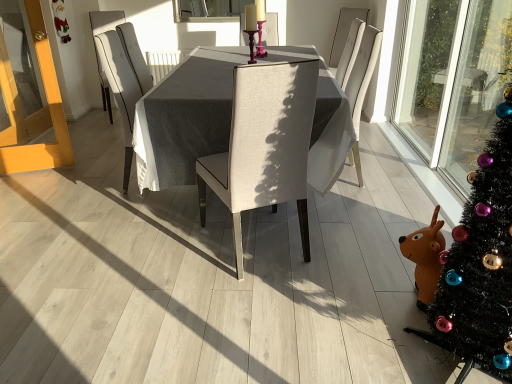
Where is `vacant area that is in front of textured gray table at center`? The height and width of the screenshot is (384, 512). vacant area that is in front of textured gray table at center is located at coordinates (197, 288).